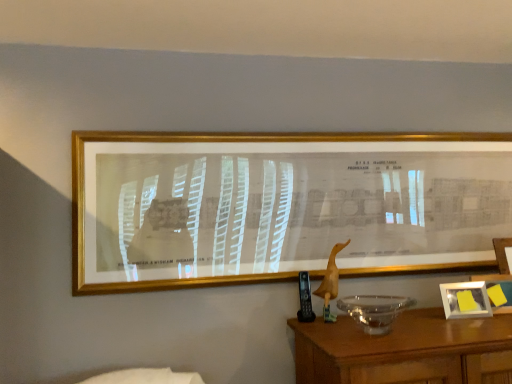
The width and height of the screenshot is (512, 384). Describe the element at coordinates (465, 300) in the screenshot. I see `white plastic picture frame at lower right, which is the second picture frame from top to bottom` at that location.

At what (x,y) coordinates should I click in order to perform the action: click on white plastic picture frame at lower right, acting as the 2th picture frame starting from the front. Please return your answer as a coordinate pair (x, y). The image size is (512, 384). Looking at the image, I should click on (465, 300).

The width and height of the screenshot is (512, 384). Find the location of `transparent glass bowl at lower right`. transparent glass bowl at lower right is located at coordinates (375, 310).

Can you confirm if transparent glass bowl at lower right is positioned to the left of white plastic picture frame at lower right, acting as the 2th picture frame starting from the front?

Indeed, transparent glass bowl at lower right is positioned on the left side of white plastic picture frame at lower right, acting as the 2th picture frame starting from the front.

Looking at their sizes, would you say transparent glass bowl at lower right is wider or thinner than white plastic picture frame at lower right, the 1th picture frame in the bottom-to-top sequence?

Clearly, transparent glass bowl at lower right has more width compared to white plastic picture frame at lower right, the 1th picture frame in the bottom-to-top sequence.

You are a GUI agent. You are given a task and a screenshot of the screen. Output one action in this format:
    pyautogui.click(x=<x>, y=<y>)
    Task: Click on the picture frame directly beneath the transparent glass bowl at lower right (from a real-world perspective)
    The height and width of the screenshot is (384, 512).
    Given the screenshot: What is the action you would take?
    pyautogui.click(x=465, y=300)

What's the angular difference between transparent glass bowl at lower right and white plastic picture frame at lower right, positioned as the 2th picture frame in left-to-right order,'s facing directions?

10.6 degrees.

Looking at this image, from the image's perspective, would you say gold metallic picture frame at upper center, which is the second picture frame in bottom-to-top order, is shown under transparent glass bowl at lower right?

No, from the image's perspective, gold metallic picture frame at upper center, which is the second picture frame in bottom-to-top order, is not beneath transparent glass bowl at lower right.

Find the location of a particular element. The height and width of the screenshot is (384, 512). picture frame above the transparent glass bowl at lower right (from a real-world perspective) is located at coordinates (279, 205).

From a real-world perspective, is gold metallic picture frame at upper center, the 1th picture frame from the front, above or below transparent glass bowl at lower right?

Clearly, from a real-world perspective, gold metallic picture frame at upper center, the 1th picture frame from the front, is above transparent glass bowl at lower right.

Considering the points (346, 149) and (396, 314), which point is in front, point (346, 149) or point (396, 314)?

The point (396, 314) is closer to the camera.

Is white plastic picture frame at lower right, positioned as the first picture frame in right-to-left order, taller than transparent glass bowl at lower right?

In fact, white plastic picture frame at lower right, positioned as the first picture frame in right-to-left order, may be shorter than transparent glass bowl at lower right.

How many degrees apart are the facing directions of white plastic picture frame at lower right, acting as the 2th picture frame starting from the front, and transparent glass bowl at lower right?

The angular difference between white plastic picture frame at lower right, acting as the 2th picture frame starting from the front, and transparent glass bowl at lower right is 10.6 degrees.

Where is `picture frame lying below the transparent glass bowl at lower right (from the image's perspective)`? This screenshot has height=384, width=512. picture frame lying below the transparent glass bowl at lower right (from the image's perspective) is located at coordinates (465, 300).

From a real-world perspective, is white plastic picture frame at lower right, positioned as the first picture frame in right-to-left order, on transparent glass bowl at lower right?

No, from a real-world perspective, white plastic picture frame at lower right, positioned as the first picture frame in right-to-left order, is not over transparent glass bowl at lower right

Is point (179, 218) closer to camera compared to point (470, 288)?

No, it is not.

Looking at their sizes, would you say gold metallic picture frame at upper center, the first picture frame positioned from the top, is wider or thinner than white plastic picture frame at lower right, the 1th picture frame in the bottom-to-top sequence?

In the image, gold metallic picture frame at upper center, the first picture frame positioned from the top, appears to be wider than white plastic picture frame at lower right, the 1th picture frame in the bottom-to-top sequence.

Is gold metallic picture frame at upper center, arranged as the 1th picture frame when viewed from the left, to the left of white plastic picture frame at lower right, positioned as the first picture frame in right-to-left order, from the viewer's perspective?

Yes.

Looking at this image, who is bigger, gold metallic picture frame at upper center, the 2th picture frame from the right, or white plastic picture frame at lower right, positioned as the 2th picture frame in left-to-right order?

Bigger between the two is gold metallic picture frame at upper center, the 2th picture frame from the right.

Locate an element on the screen. The height and width of the screenshot is (384, 512). glass bowl on the right of gold metallic picture frame at upper center, the first picture frame positioned from the top is located at coordinates (375, 310).

Considering the relative sizes of transparent glass bowl at lower right and gold metallic picture frame at upper center, the 1th picture frame from the front, in the image provided, is transparent glass bowl at lower right bigger than gold metallic picture frame at upper center, the 1th picture frame from the front,?

No.

From a real-world perspective, which is physically above, transparent glass bowl at lower right or gold metallic picture frame at upper center, the 2th picture frame from the right?

gold metallic picture frame at upper center, the 2th picture frame from the right, is physically above.

From the image's perspective, which is below, white plastic picture frame at lower right, the 1th picture frame in the bottom-to-top sequence, or gold metallic picture frame at upper center, the 1th picture frame from the front?

white plastic picture frame at lower right, the 1th picture frame in the bottom-to-top sequence.

Considering the sizes of white plastic picture frame at lower right, acting as the 2th picture frame starting from the front, and gold metallic picture frame at upper center, which is the second picture frame in bottom-to-top order, in the image, is white plastic picture frame at lower right, acting as the 2th picture frame starting from the front, bigger or smaller than gold metallic picture frame at upper center, which is the second picture frame in bottom-to-top order,?

Considering their sizes, white plastic picture frame at lower right, acting as the 2th picture frame starting from the front, takes up less space than gold metallic picture frame at upper center, which is the second picture frame in bottom-to-top order.

Is white plastic picture frame at lower right, acting as the 1th picture frame starting from the back, aimed at gold metallic picture frame at upper center, the 1th picture frame from the front?

No.

In the image, is white plastic picture frame at lower right, positioned as the 2th picture frame in left-to-right order, on the left side or the right side of gold metallic picture frame at upper center, which is the second picture frame in bottom-to-top order?

From the image, it's evident that white plastic picture frame at lower right, positioned as the 2th picture frame in left-to-right order, is to the right of gold metallic picture frame at upper center, which is the second picture frame in bottom-to-top order.

Locate an element on the screen. picture frame below the transparent glass bowl at lower right (from the image's perspective) is located at coordinates (465, 300).

Locate an element on the screen. The image size is (512, 384). glass bowl in front of the gold metallic picture frame at upper center, placed as the 2th picture frame when sorted from back to front is located at coordinates (375, 310).

Estimate the real-world distances between objects in this image. Which object is closer to white plastic picture frame at lower right, the 1th picture frame in the bottom-to-top sequence, gold metallic picture frame at upper center, placed as the 2th picture frame when sorted from back to front, or transparent glass bowl at lower right?

transparent glass bowl at lower right is closer to white plastic picture frame at lower right, the 1th picture frame in the bottom-to-top sequence.

When comparing their distances from gold metallic picture frame at upper center, the 1th picture frame from the front, does transparent glass bowl at lower right or white plastic picture frame at lower right, the 1th picture frame in the bottom-to-top sequence, seem further?

Based on the image, white plastic picture frame at lower right, the 1th picture frame in the bottom-to-top sequence, appears to be further to gold metallic picture frame at upper center, the 1th picture frame from the front.

Looking at the image, which one is located further to gold metallic picture frame at upper center, placed as the 2th picture frame when sorted from back to front, white plastic picture frame at lower right, acting as the 2th picture frame starting from the front, or transparent glass bowl at lower right?

white plastic picture frame at lower right, acting as the 2th picture frame starting from the front, lies further to gold metallic picture frame at upper center, placed as the 2th picture frame when sorted from back to front, than the other object.

When comparing their distances from white plastic picture frame at lower right, positioned as the first picture frame in right-to-left order, does transparent glass bowl at lower right or gold metallic picture frame at upper center, placed as the 2th picture frame when sorted from back to front, seem closer?

transparent glass bowl at lower right.

Based on their spatial positions, is gold metallic picture frame at upper center, placed as the 2th picture frame when sorted from back to front, or white plastic picture frame at lower right, positioned as the 2th picture frame in left-to-right order, closer to transparent glass bowl at lower right?

The object closer to transparent glass bowl at lower right is white plastic picture frame at lower right, positioned as the 2th picture frame in left-to-right order.

Which object lies nearer to the anchor point transparent glass bowl at lower right, white plastic picture frame at lower right, acting as the 1th picture frame starting from the back, or gold metallic picture frame at upper center, the 1th picture frame from the front?

white plastic picture frame at lower right, acting as the 1th picture frame starting from the back, lies closer to transparent glass bowl at lower right than the other object.

Where is `glass bowl between gold metallic picture frame at upper center, arranged as the 1th picture frame when viewed from the left, and white plastic picture frame at lower right, which is the second picture frame from top to bottom, from left to right`? glass bowl between gold metallic picture frame at upper center, arranged as the 1th picture frame when viewed from the left, and white plastic picture frame at lower right, which is the second picture frame from top to bottom, from left to right is located at coordinates (375, 310).